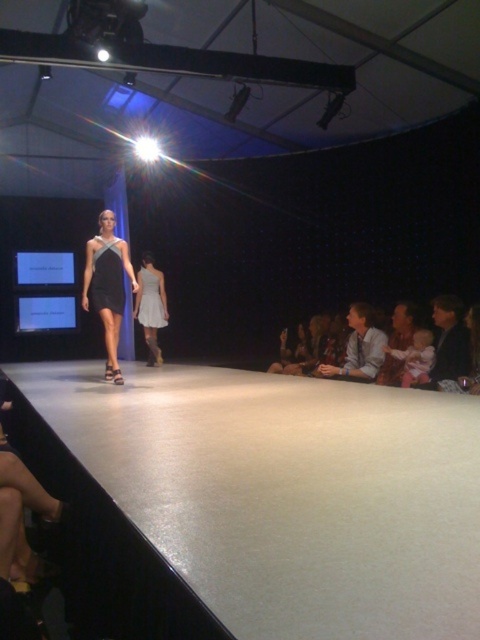
You are a photographer positioned at the end of the runway with a camera that has a maximum focus range of 6 feet. You want to capture a photo of both the light gray fabric dress at center and the black satin dress at center in the same frame. Can your camera focus on both dresses simultaneously?

The light gray fabric dress at center and the black satin dress at center are 5.75 feet apart. Since the camera has a maximum focus range of 6 feet, it can focus on both dresses simultaneously as the distance between them is within the camera

In the fashion show scene, there are two models on the runway. One is wearing a black dress with a geometric pattern and the other is wearing a light gray fabric dress at center. Which model is closer to the point located at coordinates (151, 307)?

The light gray fabric dress at center is exactly at the point (151, 307), so it is the closest to that coordinate.

You are a photographer positioned at the end of the runway. You notice two models wearing the satin black dress at center and the satin dress at center. Which model should you focus on to capture a taller figure in your photo?

The model wearing the satin black dress at center is much taller than the satin dress at center, so you should focus on the model wearing the satin black dress at center to capture a taller figure in your photo.